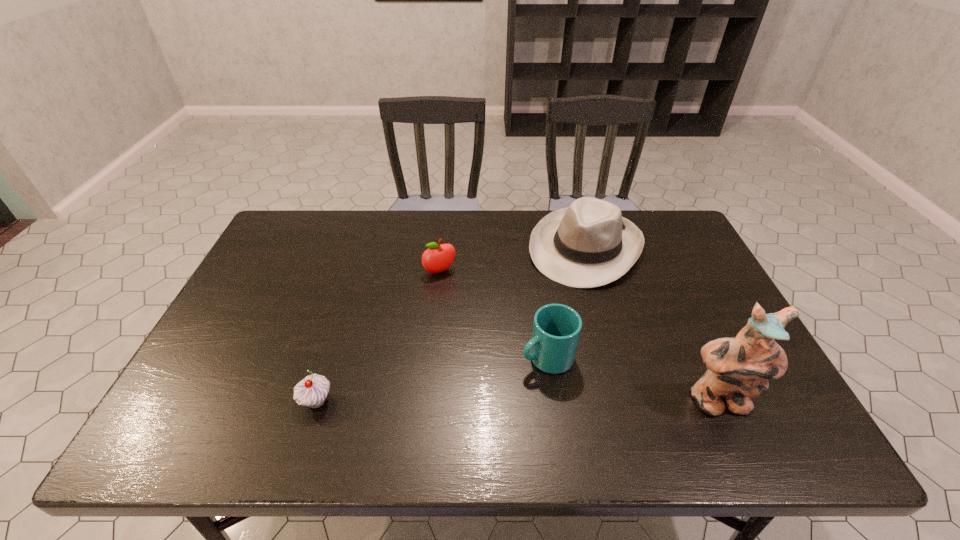
The width and height of the screenshot is (960, 540). I want to click on vacant position located 0.160m on the handle side of the third farthest object, so click(x=467, y=395).

At what (x,y) coordinates should I click in order to perform the action: click on free region located 0.170m on the handle side of the third farthest object. Please return your answer as a coordinate pair (x, y). Image resolution: width=960 pixels, height=540 pixels. Looking at the image, I should click on (463, 397).

Find the location of a particular element. This screenshot has width=960, height=540. vacant area located on the front-facing side of the apple is located at coordinates (482, 339).

I want to click on vacant space located 0.250m on the front-facing side of the apple, so click(x=480, y=336).

You are a GUI agent. You are given a task and a screenshot of the screen. Output one action in this format:
    pyautogui.click(x=<x>, y=<y>)
    Task: Click on the free location located on the front-facing side of the apple
    The height and width of the screenshot is (540, 960).
    Given the screenshot: What is the action you would take?
    pyautogui.click(x=492, y=356)

This screenshot has height=540, width=960. I want to click on object positioned at the far edge, so click(589, 244).

Locate an element on the screen. Image resolution: width=960 pixels, height=540 pixels. cupcake at the near edge is located at coordinates (312, 391).

This screenshot has height=540, width=960. I want to click on figurine that is at the near edge, so click(739, 368).

Find the location of a particular element. Image resolution: width=960 pixels, height=540 pixels. figurine at the right edge is located at coordinates (739, 368).

Where is `fedora that is at the right edge`? This screenshot has height=540, width=960. fedora that is at the right edge is located at coordinates (589, 244).